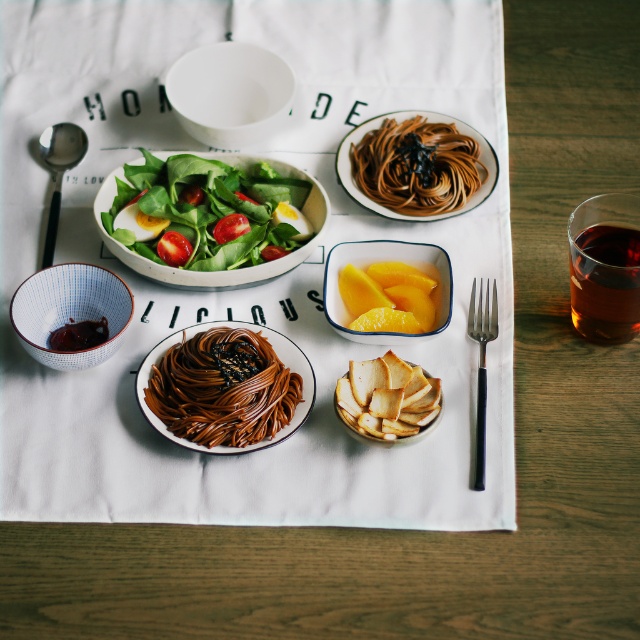
Question: Based on their relative distances, which object is nearer to the golden crispy bread at center?

Choices:
 (A) blue and white ceramic bowl at lower left
 (B) translucent amber liquid at upper right
 (C) shiny brown noodles at center
 (D) white matte bowl at upper center

Answer: (C)

Question: Which is nearer to the brown glossy pasta at center?

Choices:
 (A) white matte bowl at upper center
 (B) silver metallic fork at right
 (C) yellow translucent glass bowl at center
 (D) golden crispy bread at center

Answer: (C)

Question: Which object appears closest to the camera in this image?

Choices:
 (A) shiny brown noodles at center
 (B) golden crispy bread at center

Answer: (B)

Question: Does green leafymaterial/textureobject at upper center appear on the right side of golden crispy bread at center?

Choices:
 (A) no
 (B) yes

Answer: (A)

Question: Does brown glossy pasta at center lie behind blue and white ceramic bowl at lower left?

Choices:
 (A) yes
 (B) no

Answer: (A)

Question: In this image, where is green leafymaterial/textureobject at upper center located relative to blue and white ceramic bowl at lower left?

Choices:
 (A) right
 (B) left

Answer: (A)